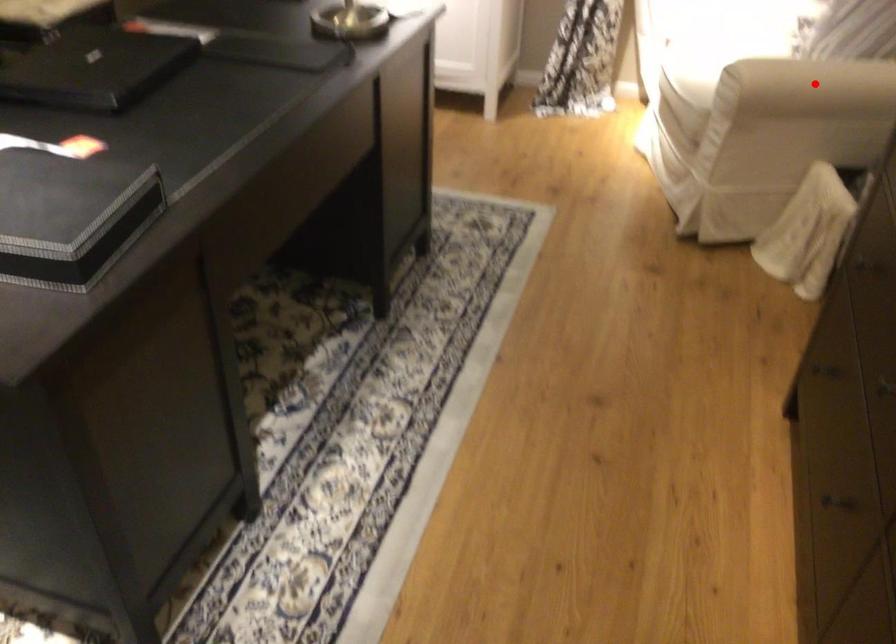
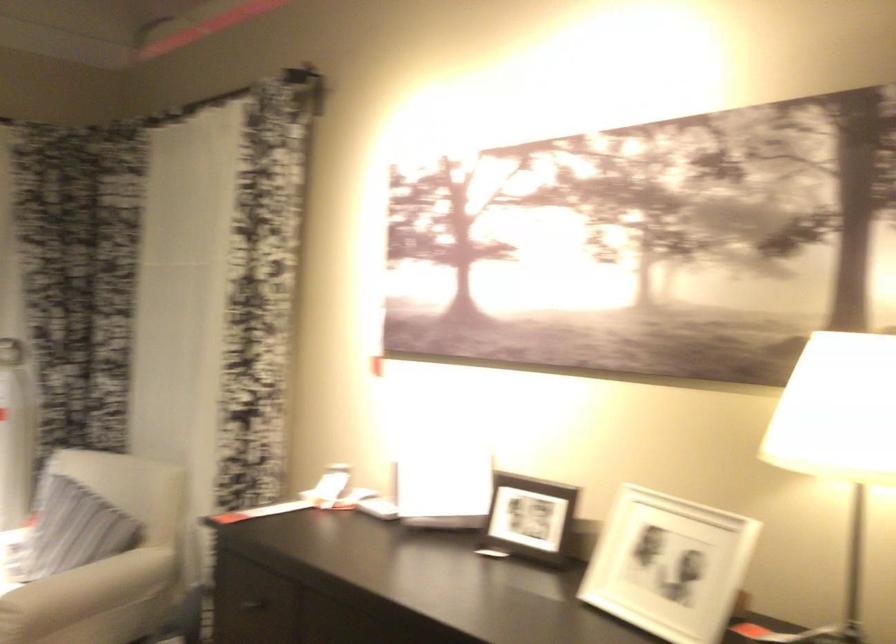
Question: A red point is marked in image1. In image2, is the corresponding 3D point closer to the camera or farther? Reply with the corresponding letter.

Choices:
 (A) The corresponding 3D point is closer.
 (B) The corresponding 3D point is farther.

Answer: (B)